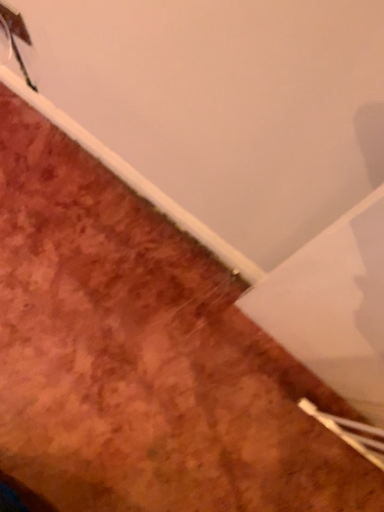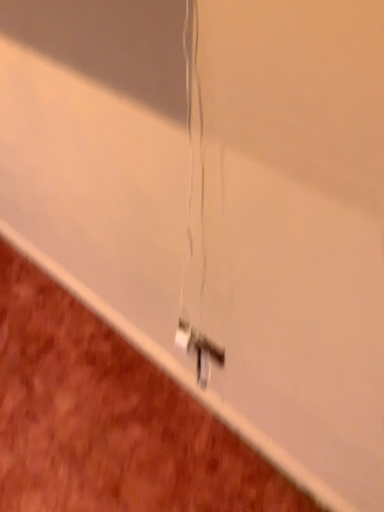
Question: How did the camera likely rotate when shooting the video?

Choices:
 (A) rotated right
 (B) rotated left

Answer: (B)